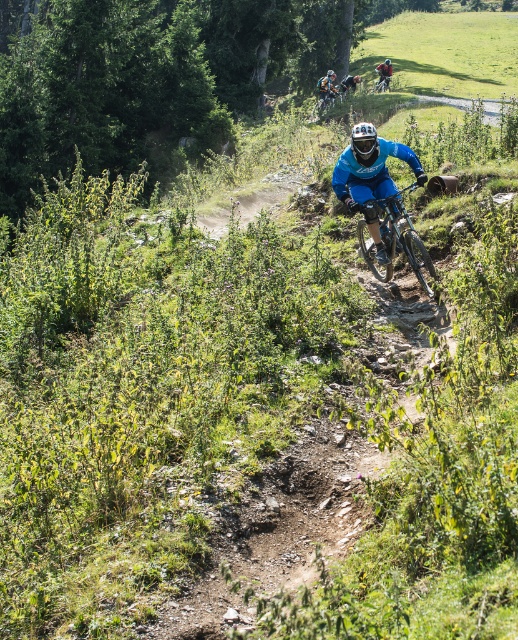
Is shiny blue frame at center to the right of blue matte helmet at upper center from the viewer's perspective?

No, shiny blue frame at center is not to the right of blue matte helmet at upper center.

From the picture: Can you confirm if shiny blue frame at center is positioned to the left of blue matte helmet at upper center?

Yes, shiny blue frame at center is to the left of blue matte helmet at upper center.

Describe the element at coordinates (404, 237) in the screenshot. The width and height of the screenshot is (518, 640). I see `shiny blue frame at center` at that location.

I want to click on shiny blue frame at center, so click(404, 237).

Between blue matte bicycle at center and shiny blue frame at center, which one appears on the left side from the viewer's perspective?

blue matte bicycle at center

Locate an element on the screen. This screenshot has width=518, height=640. blue matte bicycle at center is located at coordinates (369, 168).

Which is below, blue matte bicycle at center or blue matte helmet at upper center?

blue matte bicycle at center is lower down.

Does point (363, 168) come behind point (385, 84)?

No, it is in front of (385, 84).

The image size is (518, 640). Identify the location of blue matte bicycle at center. (369, 168).